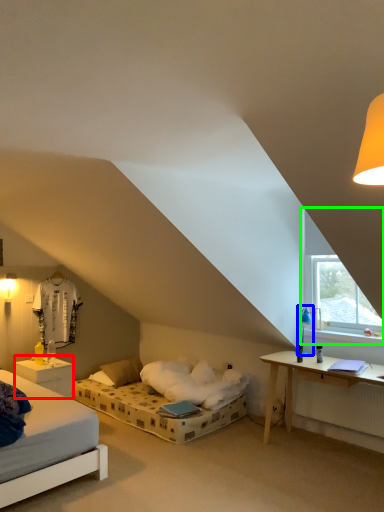
Question: Based on their relative distances, which object is nearer to nightstand (highlighted by a red box)? Choose from table lamp (highlighted by a blue box) and window (highlighted by a green box).

Choices:
 (A) table lamp
 (B) window

Answer: (A)